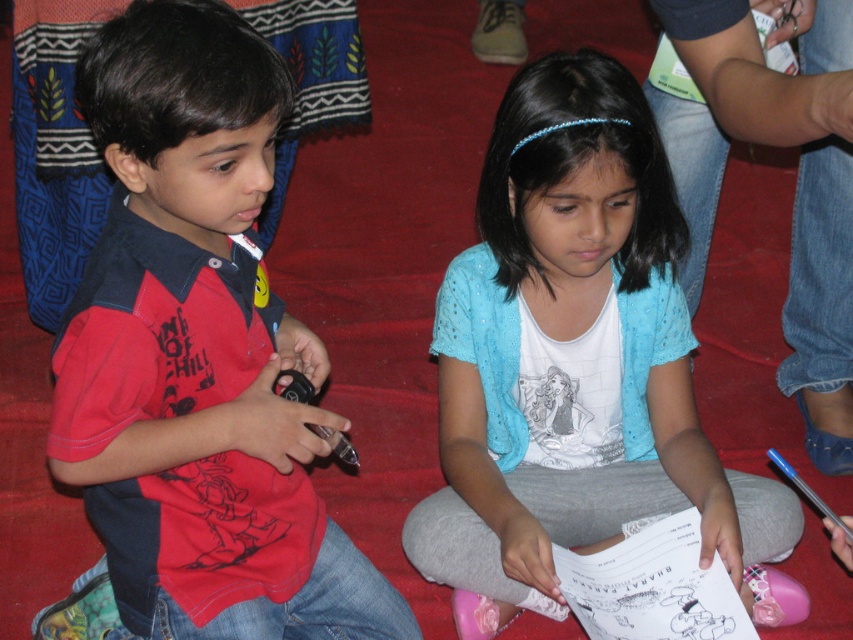
You are a parent trying to fold laundry. You have two shirts to fold, the red matte shirt at left and the blue cotton shirt at center. Which shirt should you fold first if you want to start with the narrower one?

The red matte shirt at left has a lesser width compared to the blue cotton shirt at center, so you should fold the red matte shirt at left first.

You are a parent trying to dress your children for a school day. You have two shirts available, the red matte shirt at left and the blue cotton shirt at center. Which shirt should you choose if you want the shirt to be longer?

The blue cotton shirt at center is longer than the red matte shirt at left, so you should choose the blue cotton shirt at center.

You are a parent trying to organize a play area for two children. You have a toy box that can only accommodate items within a 15 inch radius. The red matte shirt at left and blue cotton shirt at center are currently placed in the play area. Can both shirts fit inside the toy box without overlapping?

The distance between the red matte shirt at left and the blue cotton shirt at center is 16.50 inches. Since the toy box requires items to be within a 15 inch radius to fit without overlapping, the shirts are too far apart to both fit inside the toy box.